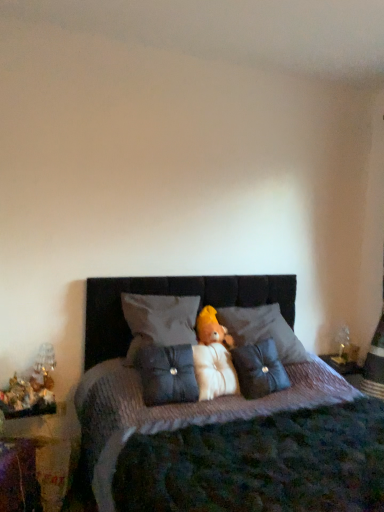
Question: Is velvet dark brown bed at center situated inside velvet plush bear at center or outside?

Choices:
 (A) inside
 (B) outside

Answer: (B)

Question: Considering the positions of velvet dark brown bed at center and velvet plush bear at center in the image, is velvet dark brown bed at center wider or thinner than velvet plush bear at center?

Choices:
 (A) wide
 (B) thin

Answer: (A)

Question: Which of these objects is positioned farthest from the gray fabric pillow at center, which is counted as the first pillow, starting from the left?

Choices:
 (A) suede-like dark blue pillow at center, the 2th pillow viewed from the right
 (B) velvet dark brown bed at center
 (C) metallic silver toy at left
 (D) dark blue fabric pillow at center, the first pillow viewed from the right
 (E) velvet plush bear at center

Answer: (C)

Question: Which is nearer to the suede-like dark blue pillow at center, the 2th pillow viewed from the right?

Choices:
 (A) metallic silver toy at left
 (B) velvet dark brown bed at center
 (C) soft yellow plush bear at center
 (D) velvet plush bear at center
 (E) dark blue fabric pillow at center, marked as the 3th pillow in a left-to-right arrangement

Answer: (D)